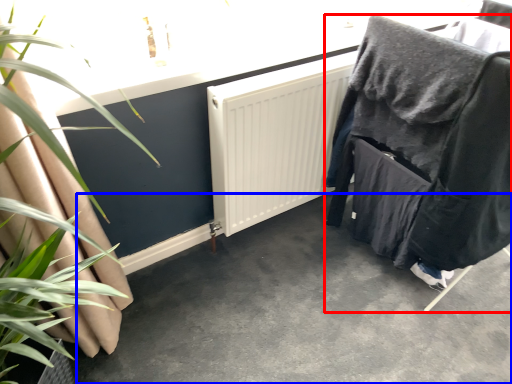
Question: Which of the following is the closest to the observer, furniture (highlighted by a red box) or concrete (highlighted by a blue box)?

Choices:
 (A) furniture
 (B) concrete

Answer: (B)